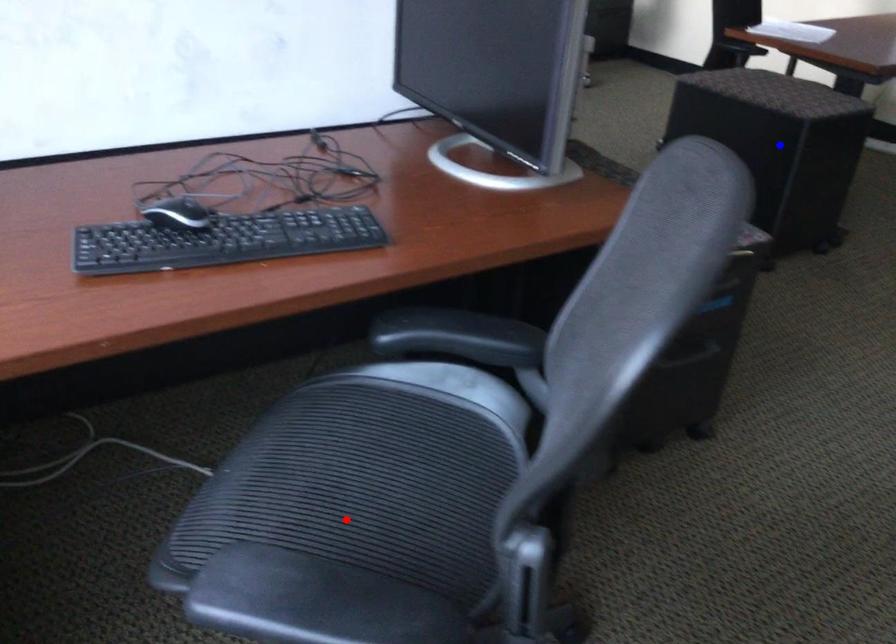
Question: Two points are marked on the image. Which point is closer to the camera?

Choices:
 (A) Blue point is closer.
 (B) Red point is closer.

Answer: (B)